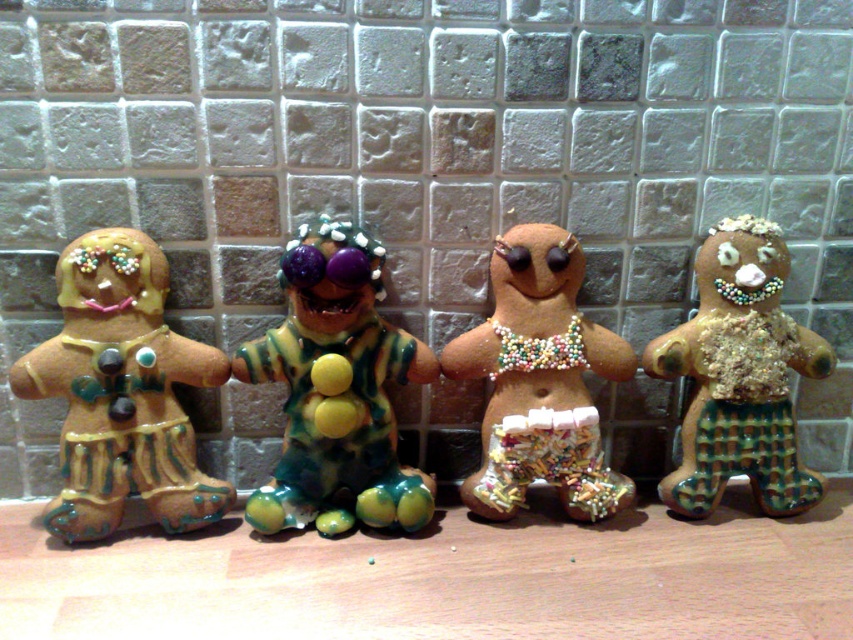
Can you confirm if matte brown gingerbread man at left is taller than glossy ceramic gingerbread man at center?

Incorrect, matte brown gingerbread man at left's height is not larger of glossy ceramic gingerbread man at center's.

Measure the distance between matte brown gingerbread man at left and camera.

matte brown gingerbread man at left and camera are 36.90 inches apart.

The image size is (853, 640). I want to click on matte brown gingerbread man at left, so click(x=120, y=392).

Does matte brown gingerbread man at left appear on the left side of glittery gingerbread man at center?

Yes, matte brown gingerbread man at left is to the left of glittery gingerbread man at center.

Is point (80, 260) positioned behind point (532, 470)?

No, it is in front of (532, 470).

At what (x,y) coordinates should I click in order to perform the action: click on matte brown gingerbread man at left. Please return your answer as a coordinate pair (x, y). Looking at the image, I should click on (120, 392).

Between glossy ceramic gingerbread man at center and glittery brown gingerbread man at right, which one appears on the left side from the viewer's perspective?

Positioned to the left is glossy ceramic gingerbread man at center.

Can you confirm if glossy ceramic gingerbread man at center is wider than glittery brown gingerbread man at right?

Indeed, glossy ceramic gingerbread man at center has a greater width compared to glittery brown gingerbread man at right.

Is point (413, 516) positioned before point (766, 320)?

Yes, it is in front of point (766, 320).

This screenshot has width=853, height=640. What are the coordinates of `glossy ceramic gingerbread man at center` in the screenshot? It's located at (337, 392).